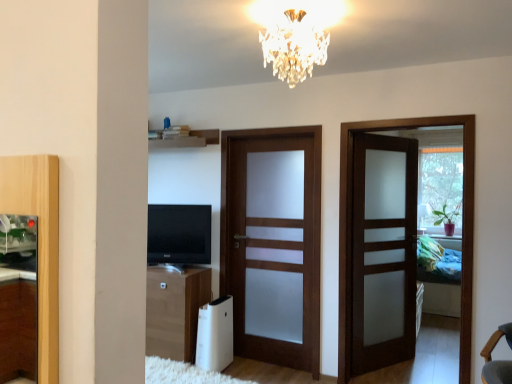
What is the approximate width of satin wood door at right, marked as the 3th door in a left-to-right arrangement?

It is 7.70 inches.

Find the location of `white plastic air purifier at lower center`. white plastic air purifier at lower center is located at coordinates (215, 335).

In order to click on wooden shelf at upper center in this screenshot , I will do `click(187, 140)`.

The image size is (512, 384). In order to click on satin wood door at center, which is the 3th door in right-to-left order in this screenshot , I will do 273,251.

The width and height of the screenshot is (512, 384). Identify the location of crystal glass chandelier at upper center. (294, 46).

Which object is more forward, crystal glass chandelier at upper center or wooden shelf at upper center?

crystal glass chandelier at upper center is closer to the camera.

In order to click on shelf on the left of crystal glass chandelier at upper center in this screenshot , I will do `click(187, 140)`.

From their relative heights in the image, would you say crystal glass chandelier at upper center is taller or shorter than wooden shelf at upper center?

Considering their sizes, crystal glass chandelier at upper center has more height than wooden shelf at upper center.

Looking at this image, is brown matte door at center, the 2th door viewed from the right, oriented towards satin wood door at center, which is the 3th door in right-to-left order?

No, brown matte door at center, the 2th door viewed from the right, is not facing towards satin wood door at center, which is the 3th door in right-to-left order.

Find the location of a particular element. The height and width of the screenshot is (384, 512). door on the left of the brown matte door at center, the 2th door viewed from the right is located at coordinates (273, 251).

Is brown matte door at center, the 2th door viewed from the right, positioned beyond the bounds of satin wood door at center, which appears as the first door when viewed from the left?

That's correct, brown matte door at center, the 2th door viewed from the right, is outside of satin wood door at center, which appears as the first door when viewed from the left.

Who is taller, satin wood door at center, which appears as the first door when viewed from the left, or crystal glass chandelier at upper center?

With more height is satin wood door at center, which appears as the first door when viewed from the left.

Is satin wood door at center, which appears as the first door when viewed from the left, touching crystal glass chandelier at upper center?

No, satin wood door at center, which appears as the first door when viewed from the left, is not touching crystal glass chandelier at upper center.

Is satin wood door at center, which is the 3th door in right-to-left order, bigger or smaller than crystal glass chandelier at upper center?

Considering their sizes, satin wood door at center, which is the 3th door in right-to-left order, takes up more space than crystal glass chandelier at upper center.

Consider the image. Considering their positions, is satin wood door at center, which appears as the first door when viewed from the left, located in front of or behind crystal glass chandelier at upper center?

satin wood door at center, which appears as the first door when viewed from the left, is behind crystal glass chandelier at upper center.

Would you say satin wood door at right, which is the 1th door from right to left, is outside wooden cabinet at lower left?

That's correct, satin wood door at right, which is the 1th door from right to left, is outside of wooden cabinet at lower left.

Is satin wood door at right, which is the 1th door from right to left, shorter than wooden cabinet at lower left?

Incorrect, the height of satin wood door at right, which is the 1th door from right to left, does not fall short of that of wooden cabinet at lower left.

Looking at this image, how different are the orientations of satin wood door at right, marked as the 3th door in a left-to-right arrangement, and wooden cabinet at lower left in degrees?

They differ by 1.88 degrees in their facing directions.

Is satin wood door at right, marked as the 3th door in a left-to-right arrangement, further to the viewer compared to wooden cabinet at lower left?

No, satin wood door at right, marked as the 3th door in a left-to-right arrangement, is closer to the camera.

Is crystal glass chandelier at upper center with black glossy tv at center?

No, crystal glass chandelier at upper center is not beside black glossy tv at center.

Which is closer, (326, 34) or (210, 238)?

The point (326, 34) is more forward.

From the picture: Considering the relative positions of crystal glass chandelier at upper center and black glossy tv at center in the image provided, is crystal glass chandelier at upper center in front of black glossy tv at center?

That is True.

Between crystal glass chandelier at upper center and black glossy tv at center, which one appears on the left side from the viewer's perspective?

black glossy tv at center.

Is black glossy tv at center with white plastic air purifier at lower center?

No, black glossy tv at center is not touching white plastic air purifier at lower center.

From a real-world perspective, between black glossy tv at center and white plastic air purifier at lower center, who is vertically higher?

black glossy tv at center, from a real-world perspective.

How much distance is there between black glossy tv at center and white plastic air purifier at lower center?

The distance of black glossy tv at center from white plastic air purifier at lower center is 67.23 centimeters.

Is black glossy tv at center smaller than white plastic air purifier at lower center?

Actually, black glossy tv at center might be larger than white plastic air purifier at lower center.

Considering the relative sizes of crystal glass chandelier at upper center and brown matte door at center, the 2th door viewed from the right, in the image provided, is crystal glass chandelier at upper center shorter than brown matte door at center, the 2th door viewed from the right,?

Yes.

From a real-world perspective, does crystal glass chandelier at upper center sit lower than brown matte door at center, placed as the second door when sorted from left to right?

No.

Is crystal glass chandelier at upper center bigger or smaller than brown matte door at center, the 2th door viewed from the right?

Considering their sizes, crystal glass chandelier at upper center takes up less space than brown matte door at center, the 2th door viewed from the right.

I want to click on lamp that is above the wooden shelf at upper center (from a real-world perspective), so click(294, 46).

From the image's perspective, which door is the 1st one above the brown matte door at center, placed as the second door when sorted from left to right? Please provide its 2D coordinates.

[(273, 251)]

From the image, which object appears to be nearer to satin wood door at center, which appears as the first door when viewed from the left, crystal glass chandelier at upper center or brown matte door at center, the 2th door viewed from the right?

brown matte door at center, the 2th door viewed from the right, lies closer to satin wood door at center, which appears as the first door when viewed from the left, than the other object.

Considering their positions, is wooden cabinet at lower left positioned further to black glossy tv at center than brown matte door at center, the 2th door viewed from the right?

Among the two, brown matte door at center, the 2th door viewed from the right, is located further to black glossy tv at center.

From the image, which object appears to be nearer to satin wood door at center, which appears as the first door when viewed from the left, wooden cabinet at lower left or black glossy tv at center?

Among the two, black glossy tv at center is located nearer to satin wood door at center, which appears as the first door when viewed from the left.

Consider the image. Based on their spatial positions, is satin wood door at center, which is the 3th door in right-to-left order, or crystal glass chandelier at upper center closer to black glossy tv at center?

Among the two, satin wood door at center, which is the 3th door in right-to-left order, is located nearer to black glossy tv at center.

When comparing their distances from satin wood door at right, which is the 1th door from right to left, does wooden cabinet at lower left or brown matte door at center, the 2th door viewed from the right, seem further?

wooden cabinet at lower left.

From the image, which object appears to be farther from wooden cabinet at lower left, black glossy tv at center or brown matte door at center, placed as the second door when sorted from left to right?

Based on the image, brown matte door at center, placed as the second door when sorted from left to right, appears to be further to wooden cabinet at lower left.

Considering their positions, is brown matte door at center, the 2th door viewed from the right, positioned further to satin wood door at center, which appears as the first door when viewed from the left, than white plastic air purifier at lower center?

Based on the image, brown matte door at center, the 2th door viewed from the right, appears to be further to satin wood door at center, which appears as the first door when viewed from the left.

Looking at the image, which one is located closer to white plastic air purifier at lower center, brown matte door at center, placed as the second door when sorted from left to right, or satin wood door at center, which is the 3th door in right-to-left order?

Based on the image, satin wood door at center, which is the 3th door in right-to-left order, appears to be nearer to white plastic air purifier at lower center.

At what (x,y) coordinates should I click in order to perform the action: click on cabinetry between black glossy tv at center and white plastic air purifier at lower center in the up-down direction. Please return your answer as a coordinate pair (x, y). Looking at the image, I should click on (174, 311).

The image size is (512, 384). I want to click on television that lies between crystal glass chandelier at upper center and white plastic air purifier at lower center from top to bottom, so click(179, 234).

This screenshot has height=384, width=512. Identify the location of television between wooden shelf at upper center and white plastic air purifier at lower center from top to bottom. (179, 234).

Where is `television between crystal glass chandelier at upper center and wooden shelf at upper center in the front-back direction`? This screenshot has height=384, width=512. television between crystal glass chandelier at upper center and wooden shelf at upper center in the front-back direction is located at coordinates (179, 234).